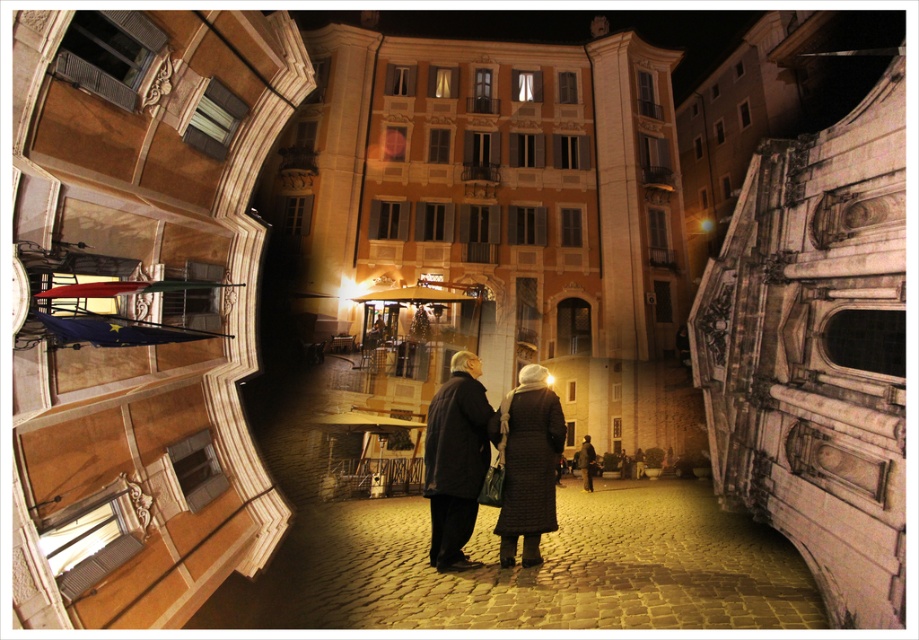
Question: Considering the real-world distances, which object is closest to the dark gray coat at center?

Choices:
 (A) quilted black coat at center
 (B) dark wool coat at center

Answer: (A)

Question: Is dark wool coat at center bigger than quilted black coat at center?

Choices:
 (A) no
 (B) yes

Answer: (B)

Question: Which of these objects is positioned closest to the quilted black coat at center?

Choices:
 (A) dark gray coat at center
 (B) dark wool coat at center

Answer: (B)

Question: Among these points, which one is nearest to the camera?

Choices:
 (A) (591, 449)
 (B) (424, 451)
 (C) (528, 390)

Answer: (B)

Question: Can you confirm if quilted black coat at center is wider than dark gray coat at center?

Choices:
 (A) no
 (B) yes

Answer: (B)

Question: Does quilted black coat at center have a greater width compared to dark gray coat at center?

Choices:
 (A) no
 (B) yes

Answer: (B)